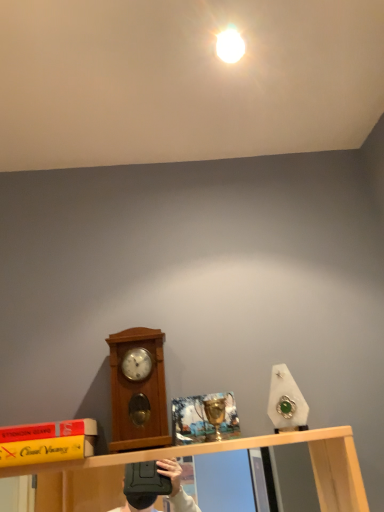
Question: Is there a large distance between wooden clock at left and white glossy light bulb at upper center?

Choices:
 (A) no
 (B) yes

Answer: (A)

Question: Would you say wooden clock at left contains white glossy light bulb at upper center?

Choices:
 (A) no
 (B) yes

Answer: (A)

Question: Is wooden clock at left at the left side of white glossy light bulb at upper center?

Choices:
 (A) no
 (B) yes

Answer: (B)

Question: From a real-world perspective, is wooden clock at left on white glossy light bulb at upper center?

Choices:
 (A) yes
 (B) no

Answer: (B)

Question: Considering the relative sizes of wooden clock at left and white glossy light bulb at upper center in the image provided, is wooden clock at left bigger than white glossy light bulb at upper center?

Choices:
 (A) yes
 (B) no

Answer: (A)

Question: Is wooden clock at left oriented away from white glossy light bulb at upper center?

Choices:
 (A) no
 (B) yes

Answer: (A)

Question: Is white glossy light bulb at upper center shorter than wooden clock at left?

Choices:
 (A) yes
 (B) no

Answer: (A)

Question: Is white glossy light bulb at upper center not within wooden clock at left?

Choices:
 (A) no
 (B) yes

Answer: (B)

Question: Does white glossy light bulb at upper center have a greater height compared to wooden clock at left?

Choices:
 (A) yes
 (B) no

Answer: (B)

Question: From a real-world perspective, does white glossy light bulb at upper center sit lower than wooden clock at left?

Choices:
 (A) yes
 (B) no

Answer: (B)

Question: Is wooden clock at left inside white glossy light bulb at upper center?

Choices:
 (A) yes
 (B) no

Answer: (B)

Question: Is white glossy light bulb at upper center directly adjacent to wooden clock at left?

Choices:
 (A) no
 (B) yes

Answer: (A)

Question: Choose the correct answer: Is white glossy light bulb at upper center inside wooden clock at left or outside it?

Choices:
 (A) outside
 (B) inside

Answer: (A)